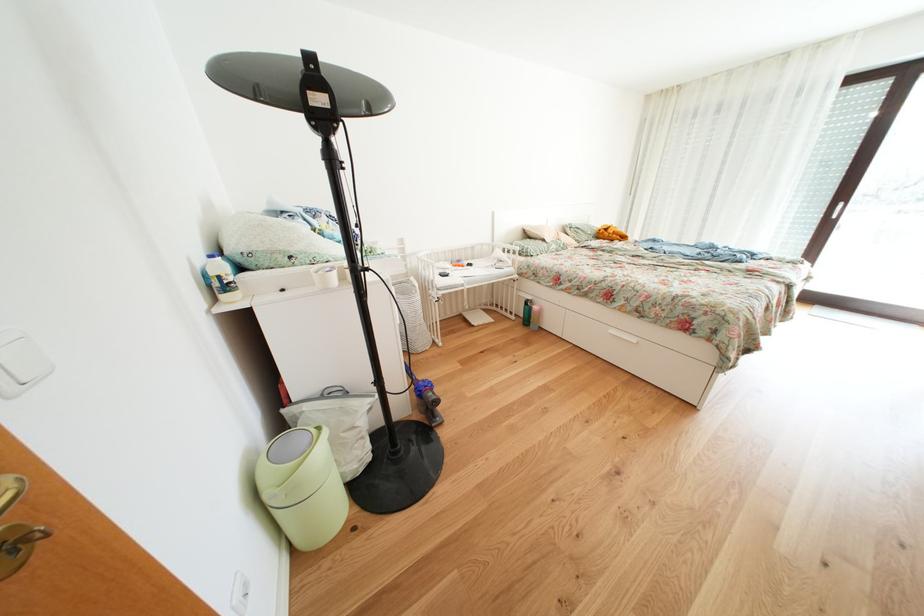
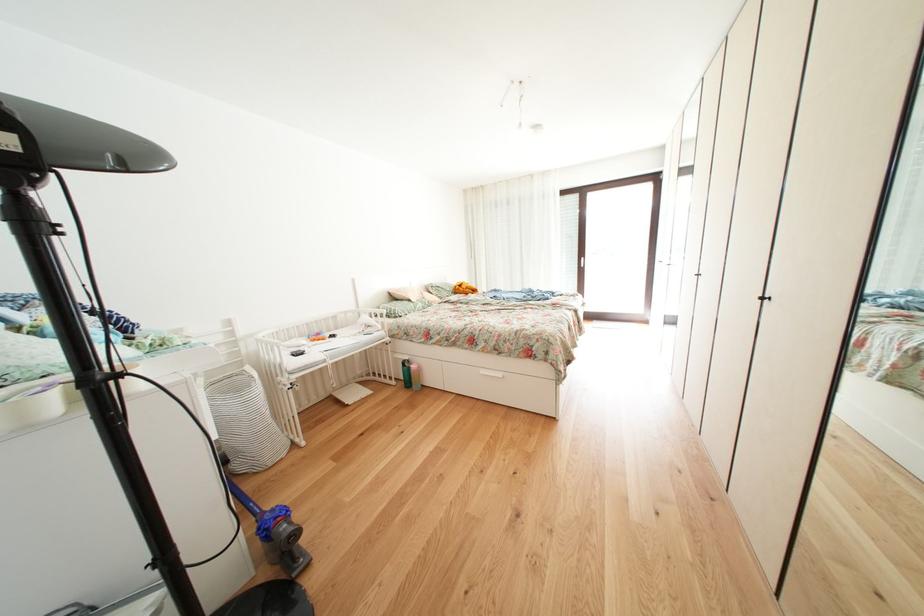
Question: The camera is either moving clockwise (left) or counter-clockwise (right) around the object. The first image is from the beginning of the video and the second image is from the end. Is the camera moving left or right when shooting the video?

Choices:
 (A) Left
 (B) Right

Answer: (A)